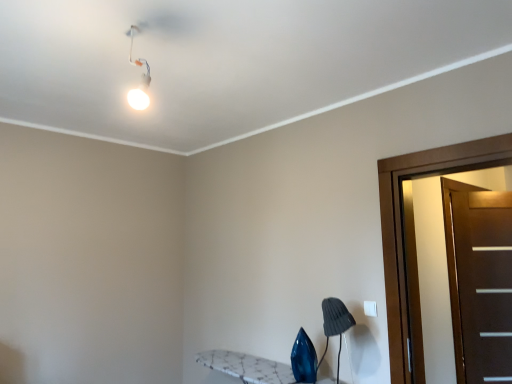
What are the coordinates of `blue glass swivel chair at lower right` in the screenshot? It's located at (304, 359).

This screenshot has width=512, height=384. What do you see at coordinates (304, 359) in the screenshot?
I see `blue glass swivel chair at lower right` at bounding box center [304, 359].

Measure the distance between dark brown wood door at right, the 1th door when ordered from front to back, and camera.

The depth of dark brown wood door at right, the 1th door when ordered from front to back, is 2.01 meters.

What do you see at coordinates (335, 324) in the screenshot?
I see `gray fabric lampshade at lower right` at bounding box center [335, 324].

This screenshot has height=384, width=512. I want to click on blue glass swivel chair at lower right, so click(x=304, y=359).

Would you say dark brown wood door at right, the 1th door positioned from the left, is part of brown matte door at right, the 1th door viewed from the back,'s contents?

No, dark brown wood door at right, the 1th door positioned from the left, is not inside brown matte door at right, the 1th door viewed from the back.

Are brown matte door at right, positioned as the 2th door in left-to-right order, and dark brown wood door at right, the 1th door when ordered from front to back, far apart?

No, brown matte door at right, positioned as the 2th door in left-to-right order, is not far away from dark brown wood door at right, the 1th door when ordered from front to back.

From the picture: Is brown matte door at right, positioned as the second door in front-to-back order, bigger or smaller than dark brown wood door at right, the second door in the right-to-left sequence?

brown matte door at right, positioned as the second door in front-to-back order, is smaller than dark brown wood door at right, the second door in the right-to-left sequence.

Is brown matte door at right, positioned as the 2th door in left-to-right order, surrounding gray fabric lampshade at lower right?

No, gray fabric lampshade at lower right is located outside of brown matte door at right, positioned as the 2th door in left-to-right order.

Does brown matte door at right, the 1th door viewed from the back, have a lesser width compared to gray fabric lampshade at lower right?

Indeed, brown matte door at right, the 1th door viewed from the back, has a lesser width compared to gray fabric lampshade at lower right.

From the image's perspective, is brown matte door at right, positioned as the 2th door in left-to-right order, above or below gray fabric lampshade at lower right?

From the image's perspective, brown matte door at right, positioned as the 2th door in left-to-right order, appears above gray fabric lampshade at lower right.

Between brown matte door at right, which is the 1th door from right to left, and gray fabric lampshade at lower right, which one has less height?

gray fabric lampshade at lower right is shorter.

Considering the sizes of dark brown wood door at right, the 1th door when ordered from front to back, and blue glass swivel chair at lower right in the image, is dark brown wood door at right, the 1th door when ordered from front to back, bigger or smaller than blue glass swivel chair at lower right?

Clearly, dark brown wood door at right, the 1th door when ordered from front to back, is larger in size than blue glass swivel chair at lower right.

Is dark brown wood door at right, the second door in the right-to-left sequence, to the left of blue glass swivel chair at lower right from the viewer's perspective?

In fact, dark brown wood door at right, the second door in the right-to-left sequence, is to the right of blue glass swivel chair at lower right.

Can you tell me how much dark brown wood door at right, the second door when ordered from back to front, and blue glass swivel chair at lower right differ in facing direction?

1.88 degrees.

How different are the orientations of gray fabric lampshade at lower right and dark brown wood door at right, the second door in the right-to-left sequence, in degrees?

0.753 degrees separate the facing orientations of gray fabric lampshade at lower right and dark brown wood door at right, the second door in the right-to-left sequence.

Is gray fabric lampshade at lower right turned away from dark brown wood door at right, the second door in the right-to-left sequence?

No, gray fabric lampshade at lower right is not facing away from dark brown wood door at right, the second door in the right-to-left sequence.

Which is behind, point (325, 316) or point (420, 163)?

The point (325, 316) is more distant.

From the image's perspective, does gray fabric lampshade at lower right appear lower than dark brown wood door at right, the second door in the right-to-left sequence?

Yes.

Which is in front, point (503, 367) or point (310, 381)?

Point (310, 381)

Looking at this image, considering their positions, is brown matte door at right, positioned as the second door in front-to-back order, located in front of or behind blue glass swivel chair at lower right?

brown matte door at right, positioned as the second door in front-to-back order, is behind blue glass swivel chair at lower right.

In the scene shown: Is brown matte door at right, the 1th door viewed from the back, with blue glass swivel chair at lower right?

brown matte door at right, the 1th door viewed from the back, and blue glass swivel chair at lower right are not in contact.

Does brown matte door at right, the 1th door viewed from the back, have a larger size compared to blue glass swivel chair at lower right?

Yes, brown matte door at right, the 1th door viewed from the back, is bigger than blue glass swivel chair at lower right.

Locate an element on the screen. The height and width of the screenshot is (384, 512). light fixture above the gray fabric lampshade at lower right (from a real-world perspective) is located at coordinates point(142,77).

Is gray fabric lampshade at lower right directly adjacent to white glossy light fixture at upper left?

No, gray fabric lampshade at lower right is not beside white glossy light fixture at upper left.

From a real-world perspective, does gray fabric lampshade at lower right stand above white glossy light fixture at upper left?

Actually, gray fabric lampshade at lower right is physically below white glossy light fixture at upper left in the real world.

Is gray fabric lampshade at lower right facing towards white glossy light fixture at upper left?

No.

Would you say gray fabric lampshade at lower right is outside brown matte door at right, the 1th door viewed from the back?

gray fabric lampshade at lower right lies outside brown matte door at right, the 1th door viewed from the back,'s area.

Is gray fabric lampshade at lower right far away from brown matte door at right, the 1th door viewed from the back?

gray fabric lampshade at lower right is positioned a significant distance from brown matte door at right, the 1th door viewed from the back.

Between gray fabric lampshade at lower right and brown matte door at right, the 1th door viewed from the back, which one has more height?

Standing taller between the two is brown matte door at right, the 1th door viewed from the back.

Is gray fabric lampshade at lower right looking in the opposite direction of brown matte door at right, positioned as the second door in front-to-back order?

No, gray fabric lampshade at lower right is not facing the opposite direction of brown matte door at right, positioned as the second door in front-to-back order.

This screenshot has height=384, width=512. I want to click on door that appears below the dark brown wood door at right, the second door when ordered from back to front (from a real-world perspective), so click(483, 284).

Identify the location of table lamp below the brown matte door at right, the 1th door viewed from the back (from the image's perspective). This screenshot has height=384, width=512. (335, 324).

Based on their spatial positions, is brown matte door at right, the 1th door viewed from the back, or dark brown wood door at right, the second door when ordered from back to front, further from gray fabric lampshade at lower right?

brown matte door at right, the 1th door viewed from the back, lies further to gray fabric lampshade at lower right than the other object.

Considering their positions, is dark brown wood door at right, the second door in the right-to-left sequence, positioned further to white glossy light fixture at upper left than blue glass swivel chair at lower right?

Based on the image, blue glass swivel chair at lower right appears to be further to white glossy light fixture at upper left.

From the image, which object appears to be nearer to dark brown wood door at right, the 1th door positioned from the left, blue glass swivel chair at lower right or white glossy light fixture at upper left?

blue glass swivel chair at lower right is closer to dark brown wood door at right, the 1th door positioned from the left.

Consider the image. From the image, which object appears to be nearer to brown matte door at right, positioned as the 2th door in left-to-right order, gray fabric lampshade at lower right or white glossy light fixture at upper left?

gray fabric lampshade at lower right is positioned closer to the anchor brown matte door at right, positioned as the 2th door in left-to-right order.

Which object lies nearer to the anchor point white glossy light fixture at upper left, dark brown wood door at right, the second door in the right-to-left sequence, or gray fabric lampshade at lower right?

dark brown wood door at right, the second door in the right-to-left sequence.

Based on the photo, estimate the real-world distances between objects in this image. Which object is further from white glossy light fixture at upper left, brown matte door at right, which is the 1th door from right to left, or dark brown wood door at right, the 1th door when ordered from front to back?

brown matte door at right, which is the 1th door from right to left, lies further to white glossy light fixture at upper left than the other object.

From the picture: Looking at the image, which one is located further to dark brown wood door at right, the 1th door positioned from the left, white glossy light fixture at upper left or brown matte door at right, positioned as the 2th door in left-to-right order?

white glossy light fixture at upper left.

Which object lies nearer to the anchor point brown matte door at right, positioned as the 2th door in left-to-right order, blue glass swivel chair at lower right or gray fabric lampshade at lower right?

Among the two, gray fabric lampshade at lower right is located nearer to brown matte door at right, positioned as the 2th door in left-to-right order.

What are the coordinates of `table lamp between white glossy light fixture at upper left and brown matte door at right, the 1th door viewed from the back, from left to right` in the screenshot? It's located at (335, 324).

Where is `table lamp between blue glass swivel chair at lower right and dark brown wood door at right, the second door in the right-to-left sequence, in the horizontal direction`? This screenshot has height=384, width=512. table lamp between blue glass swivel chair at lower right and dark brown wood door at right, the second door in the right-to-left sequence, in the horizontal direction is located at coordinates (335, 324).

Identify the location of door situated between gray fabric lampshade at lower right and brown matte door at right, positioned as the second door in front-to-back order, from left to right. (400, 225).

This screenshot has height=384, width=512. In order to click on table lamp between white glossy light fixture at upper left and blue glass swivel chair at lower right from top to bottom in this screenshot , I will do `click(335, 324)`.